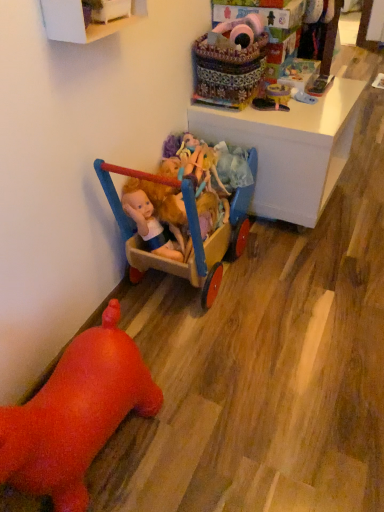
Describe the element at coordinates (242, 50) in the screenshot. The image size is (384, 512). I see `brightly colored fabric basket at upper center` at that location.

In order to click on brightly colored fabric basket at upper center in this screenshot , I will do `click(242, 50)`.

Identify the location of matte plastic doll at center, acting as the 4th toy starting from the top. Image resolution: width=384 pixels, height=512 pixels. (233, 166).

What do you see at coordinates (233, 166) in the screenshot?
I see `matte plastic doll at center, the 3th toy when ordered from bottom to top` at bounding box center [233, 166].

At what (x,y) coordinates should I click in order to perform the action: click on white painted wood cabinet at upper left. Please return your answer as a coordinate pair (x, y). The image size is (384, 512). Looking at the image, I should click on (83, 21).

What do you see at coordinates (76, 414) in the screenshot? The height and width of the screenshot is (512, 384). I see `rubber duck at lower left, which is the first toy in bottom-to-top order` at bounding box center [76, 414].

Where is `matte plastic toy at upper center, which appears as the second toy when viewed from the top`? matte plastic toy at upper center, which appears as the second toy when viewed from the top is located at coordinates coord(278,94).

I want to click on brightly colored fabric basket at upper center, so click(x=242, y=50).

Is matte plastic doll at center, acting as the 4th toy starting from the top, wider or thinner than black rubber shoe at upper right, which is the 4th toy from bottom to top?

Considering their sizes, matte plastic doll at center, acting as the 4th toy starting from the top, looks slimmer than black rubber shoe at upper right, which is the 4th toy from bottom to top.

Considering the sizes of objects matte plastic doll at center, acting as the 4th toy starting from the top, and black rubber shoe at upper right, which is the 4th toy from bottom to top, in the image provided, who is taller, matte plastic doll at center, acting as the 4th toy starting from the top, or black rubber shoe at upper right, which is the 4th toy from bottom to top,?

matte plastic doll at center, acting as the 4th toy starting from the top, is taller.

Is matte plastic doll at center, the 3th toy when ordered from bottom to top, positioned before black rubber shoe at upper right, acting as the third toy starting from the top?

Yes, it is in front of black rubber shoe at upper right, acting as the third toy starting from the top.

From a real-world perspective, is fluffy pink plush at upper center, which appears as the sixth toy when ordered from the bottom, under black rubber shoe at upper right, acting as the third toy starting from the top?

No, from a real-world perspective, fluffy pink plush at upper center, which appears as the sixth toy when ordered from the bottom, is not below black rubber shoe at upper right, acting as the third toy starting from the top.

Is fluffy pink plush at upper center, which appears as the sixth toy when ordered from the bottom, to the right of black rubber shoe at upper right, which is the 4th toy from bottom to top, from the viewer's perspective?

Incorrect, fluffy pink plush at upper center, which appears as the sixth toy when ordered from the bottom, is not on the right side of black rubber shoe at upper right, which is the 4th toy from bottom to top.

Is black rubber shoe at upper right, which is the 4th toy from bottom to top, located within fluffy pink plush at upper center, which appears as the sixth toy when ordered from the bottom?

That's incorrect, black rubber shoe at upper right, which is the 4th toy from bottom to top, is not inside fluffy pink plush at upper center, which appears as the sixth toy when ordered from the bottom.

Is fluffy pink plush at upper center, acting as the 1th toy starting from the top, bigger or smaller than black rubber shoe at upper right, acting as the third toy starting from the top?

Clearly, fluffy pink plush at upper center, acting as the 1th toy starting from the top, is larger in size than black rubber shoe at upper right, acting as the third toy starting from the top.

Which object is closer to the camera, fluffy pink plush at upper center, which appears as the sixth toy when ordered from the bottom, or rubber duck at lower left, the 6th toy when ordered from top to bottom?

rubber duck at lower left, the 6th toy when ordered from top to bottom, is in front.

Consider the image. Does fluffy pink plush at upper center, acting as the 1th toy starting from the top, turn towards rubber duck at lower left, which is the first toy in bottom-to-top order?

No.

Is fluffy pink plush at upper center, which appears as the sixth toy when ordered from the bottom, to the right of rubber duck at lower left, the 6th toy when ordered from top to bottom, from the viewer's perspective?

Indeed, fluffy pink plush at upper center, which appears as the sixth toy when ordered from the bottom, is positioned on the right side of rubber duck at lower left, the 6th toy when ordered from top to bottom.

Could you tell me if fluffy pink plush at upper center, acting as the 1th toy starting from the top, is turned towards white glossy desk at upper center?

No, fluffy pink plush at upper center, acting as the 1th toy starting from the top, is not facing towards white glossy desk at upper center.

From a real-world perspective, who is located lower, fluffy pink plush at upper center, acting as the 1th toy starting from the top, or white glossy desk at upper center?

In real-world perspective, white glossy desk at upper center is lower.

Looking at this image, does fluffy pink plush at upper center, acting as the 1th toy starting from the top, have a larger size compared to white glossy desk at upper center?

No, fluffy pink plush at upper center, acting as the 1th toy starting from the top, is not bigger than white glossy desk at upper center.

What's the angular difference between fluffy pink plush at upper center, acting as the 1th toy starting from the top, and white glossy desk at upper center's facing directions?

fluffy pink plush at upper center, acting as the 1th toy starting from the top, and white glossy desk at upper center are facing 0.000987 degrees away from each other.

From a real-world perspective, relative to white painted wood cabinet at upper left, is brightly colored fabric basket at upper center vertically above or below?

In terms of real-world spatial position, brightly colored fabric basket at upper center is below white painted wood cabinet at upper left.

Is brightly colored fabric basket at upper center taller or shorter than white painted wood cabinet at upper left?

brightly colored fabric basket at upper center is taller than white painted wood cabinet at upper left.

Is brightly colored fabric basket at upper center spatially inside white painted wood cabinet at upper left, or outside of it?

brightly colored fabric basket at upper center is located beyond the bounds of white painted wood cabinet at upper left.

Is brightly colored fabric basket at upper center bigger or smaller than white painted wood cabinet at upper left?

Clearly, brightly colored fabric basket at upper center is larger in size than white painted wood cabinet at upper left.

Would you say white painted wood cabinet at upper left is part of wooden cart at center, the 2th toy positioned from the bottom,'s contents?

Definitely not — white painted wood cabinet at upper left is not inside wooden cart at center, the 2th toy positioned from the bottom.

Which of these two, wooden cart at center, which is counted as the 5th toy, starting from the top, or white painted wood cabinet at upper left, is wider?

wooden cart at center, which is counted as the 5th toy, starting from the top.

From the image's perspective, would you say wooden cart at center, which is counted as the 5th toy, starting from the top, is positioned over white painted wood cabinet at upper left?

Incorrect, from the image's perspective, wooden cart at center, which is counted as the 5th toy, starting from the top, is lower than white painted wood cabinet at upper left.

From a real-world perspective, is rubber duck at lower left, which is the first toy in bottom-to-top order, positioned above or below black rubber shoe at upper right, acting as the third toy starting from the top?

Clearly, from a real-world perspective, rubber duck at lower left, which is the first toy in bottom-to-top order, is below black rubber shoe at upper right, acting as the third toy starting from the top.

Based on the photo, which is behind, rubber duck at lower left, which is the first toy in bottom-to-top order, or black rubber shoe at upper right, which is the 4th toy from bottom to top?

black rubber shoe at upper right, which is the 4th toy from bottom to top, is further away from the camera.

Does rubber duck at lower left, which is the first toy in bottom-to-top order, have a lesser height compared to black rubber shoe at upper right, acting as the third toy starting from the top?

In fact, rubber duck at lower left, which is the first toy in bottom-to-top order, may be taller than black rubber shoe at upper right, acting as the third toy starting from the top.

Is rubber duck at lower left, which is the first toy in bottom-to-top order, looking in the opposite direction of black rubber shoe at upper right, which is the 4th toy from bottom to top?

rubber duck at lower left, which is the first toy in bottom-to-top order, does not have its back to black rubber shoe at upper right, which is the 4th toy from bottom to top.

From the black rubber shoe at upper right, which is the 4th toy from bottom to top, count the 1st toy to the left and point to it. Please provide its 2D coordinates.

[(233, 166)]

Find the location of a particular element. This screenshot has width=384, height=512. the 2nd toy positioned below the fluffy pink plush at upper center, which appears as the sixth toy when ordered from the bottom (from the image's perspective) is located at coordinates (269, 104).

Considering their positions, is black rubber shoe at upper right, acting as the third toy starting from the top, positioned further to brightly colored fabric basket at upper center than white painted wood cabinet at upper left?

white painted wood cabinet at upper left lies further to brightly colored fabric basket at upper center than the other object.

Looking at this image, which object lies nearer to the anchor point black rubber shoe at upper right, acting as the third toy starting from the top, matte plastic toy at upper center, which is the 5th toy from bottom to top, or rubber duck at lower left, the 6th toy when ordered from top to bottom?

matte plastic toy at upper center, which is the 5th toy from bottom to top, is closer to black rubber shoe at upper right, acting as the third toy starting from the top.

In the scene shown: Estimate the real-world distances between objects in this image. Which object is further from matte plastic toy at upper center, which is the 5th toy from bottom to top, matte plastic doll at center, the 3th toy when ordered from bottom to top, or white glossy desk at upper center?

Based on the image, matte plastic doll at center, the 3th toy when ordered from bottom to top, appears to be further to matte plastic toy at upper center, which is the 5th toy from bottom to top.

In the scene shown: From the image, which object appears to be farther from matte plastic doll at center, the 3th toy when ordered from bottom to top, brightly colored fabric basket at upper center or black rubber shoe at upper right, which is the 4th toy from bottom to top?

The object further to matte plastic doll at center, the 3th toy when ordered from bottom to top, is brightly colored fabric basket at upper center.

From the image, which object appears to be nearer to wooden cart at center, which is counted as the 5th toy, starting from the top, rubber duck at lower left, the 6th toy when ordered from top to bottom, or matte plastic doll at center, acting as the 4th toy starting from the top?

matte plastic doll at center, acting as the 4th toy starting from the top, is closer to wooden cart at center, which is counted as the 5th toy, starting from the top.

Based on their spatial positions, is brightly colored fabric basket at upper center or fluffy pink plush at upper center, which appears as the sixth toy when ordered from the bottom, closer to rubber duck at lower left, which is the first toy in bottom-to-top order?

brightly colored fabric basket at upper center is positioned closer to the anchor rubber duck at lower left, which is the first toy in bottom-to-top order.

Looking at the image, which one is located further to white painted wood cabinet at upper left, fluffy pink plush at upper center, acting as the 1th toy starting from the top, or rubber duck at lower left, the 6th toy when ordered from top to bottom?

Based on the image, rubber duck at lower left, the 6th toy when ordered from top to bottom, appears to be further to white painted wood cabinet at upper left.

From the image, which object appears to be farther from matte plastic doll at center, the 3th toy when ordered from bottom to top, fluffy pink plush at upper center, acting as the 1th toy starting from the top, or brightly colored fabric basket at upper center?

Based on the image, fluffy pink plush at upper center, acting as the 1th toy starting from the top, appears to be further to matte plastic doll at center, the 3th toy when ordered from bottom to top.

This screenshot has height=512, width=384. I want to click on cabinetry between fluffy pink plush at upper center, which appears as the sixth toy when ordered from the bottom, and rubber duck at lower left, the 6th toy when ordered from top to bottom, vertically, so click(83, 21).

The height and width of the screenshot is (512, 384). What are the coordinates of `desk between white painted wood cabinet at upper left and black rubber shoe at upper right, which is the 4th toy from bottom to top, along the z-axis` in the screenshot? It's located at click(x=290, y=149).

The width and height of the screenshot is (384, 512). I want to click on desk between wooden cart at center, the 2th toy positioned from the bottom, and matte plastic doll at center, acting as the 4th toy starting from the top, in the front-back direction, so click(290, 149).

Find the location of a particular element. The height and width of the screenshot is (512, 384). desk between brightly colored fabric basket at upper center and matte plastic doll at center, acting as the 4th toy starting from the top, in the up-down direction is located at coordinates (290, 149).